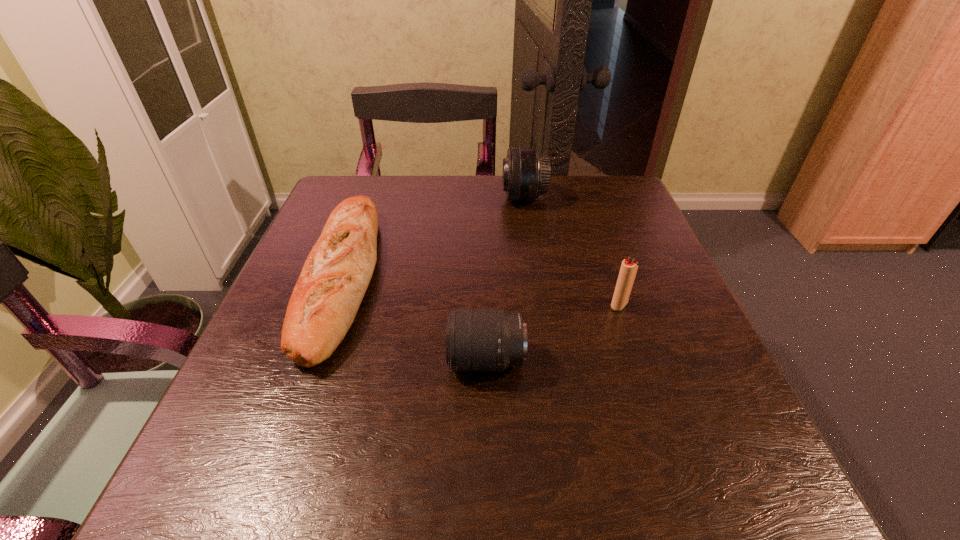
I want to click on vacant space located on the surface of the shorter telephoto lens, so click(371, 360).

Find the location of a particular element. The height and width of the screenshot is (540, 960). vacant space located 0.240m on the surface of the shorter telephoto lens is located at coordinates point(304,360).

Find the location of `free location located on the front of the baguet`. free location located on the front of the baguet is located at coordinates (269, 489).

What are the coordinates of `telephoto lens at the far edge` in the screenshot? It's located at (526, 173).

This screenshot has width=960, height=540. What are the coordinates of `baguet at the far edge` in the screenshot? It's located at (336, 274).

The width and height of the screenshot is (960, 540). In order to click on object that is at the left edge in this screenshot , I will do `click(336, 274)`.

Where is `object that is at the right edge`? This screenshot has width=960, height=540. object that is at the right edge is located at coordinates (629, 267).

You are a GUI agent. You are given a task and a screenshot of the screen. Output one action in this format:
    pyautogui.click(x=<x>, y=<y>)
    Task: Click on the object located at the far left corner
    The width and height of the screenshot is (960, 540).
    Given the screenshot: What is the action you would take?
    pyautogui.click(x=336, y=274)

The image size is (960, 540). What are the coordinates of `vacant region at the far edge of the desktop` in the screenshot? It's located at (550, 187).

In the image, there is a desktop. Where is `vacant space at the near edge`? vacant space at the near edge is located at coordinates (495, 475).